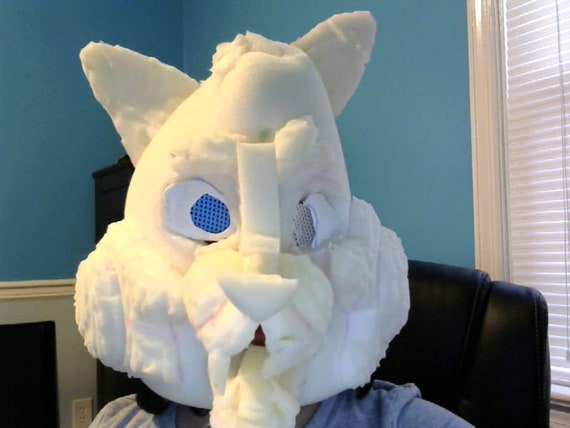
Image resolution: width=570 pixels, height=428 pixels. Find the location of `blinds`. blinds is located at coordinates (542, 153).